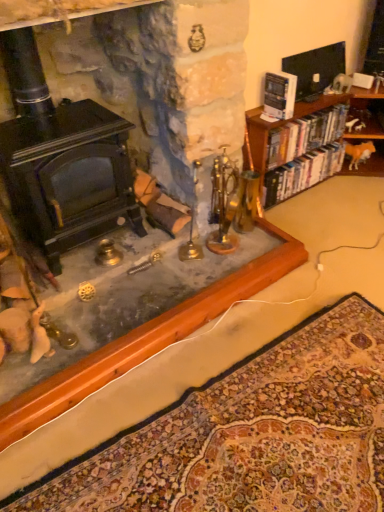
Question: From their relative heights in the image, would you say hardcover books at right, the first book when ordered from back to front, is taller or shorter than black matte fireplace at left?

Choices:
 (A) short
 (B) tall

Answer: (A)

Question: Visually, is hardcover books at right, which ranks as the 3th book in front-to-back order, positioned to the left or to the right of black matte fireplace at left?

Choices:
 (A) left
 (B) right

Answer: (B)

Question: Which object is positioned farthest from the hardcover books at right, marked as the second book in a front-to-back arrangement?

Choices:
 (A) carpeted mat at lower center
 (B) white paper book at upper right, which is the first book from front to back
 (C) hardcover books at right, which ranks as the 3th book in front-to-back order
 (D) black matte fireplace at left

Answer: (A)

Question: Estimate the real-world distances between objects in this image. Which object is farther from the carpeted mat at lower center?

Choices:
 (A) hardcover books at right, marked as the second book in a front-to-back arrangement
 (B) black matte fireplace at left
 (C) hardcover books at right, the first book when ordered from back to front
 (D) white paper book at upper right, the third book when ordered from back to front

Answer: (D)